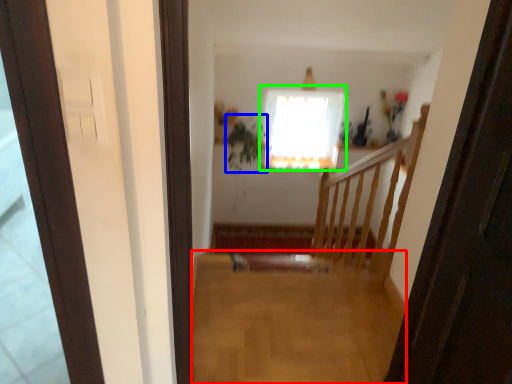
Question: Which object is positioned closest to plain (highlighted by a red box)? Select from plant (highlighted by a blue box) and window (highlighted by a green box).

Choices:
 (A) plant
 (B) window

Answer: (B)